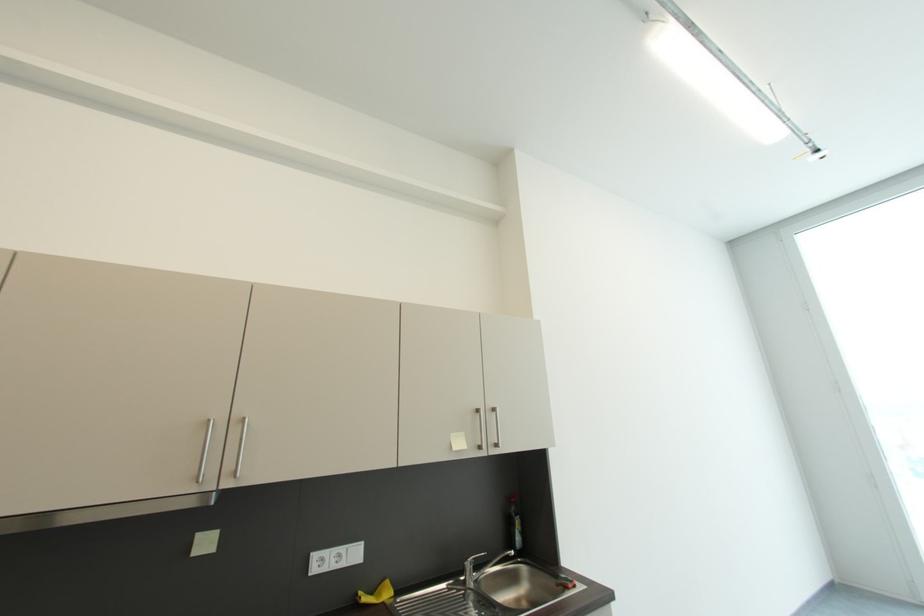
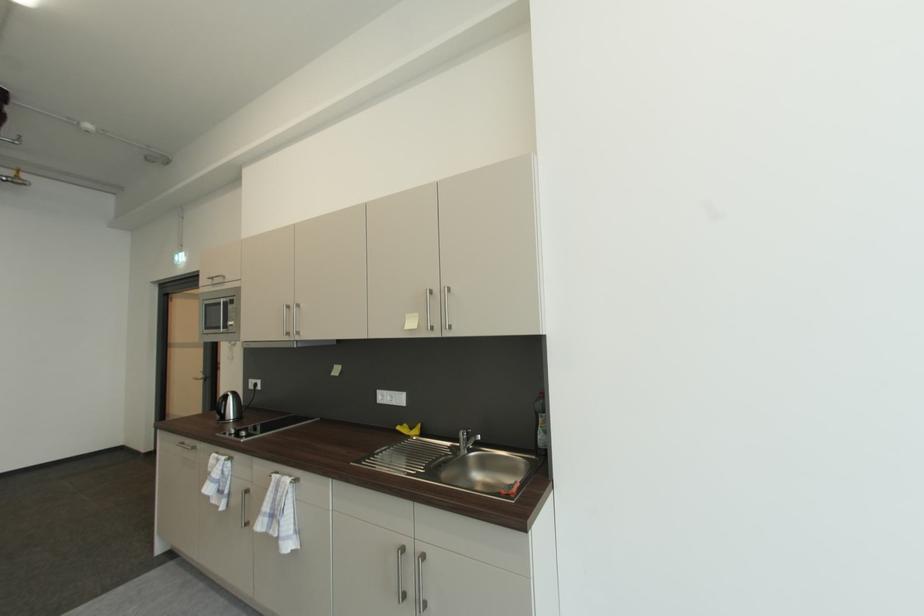
The point at (x=470, y=567) is marked in the first image. Where is the corresponding point in the second image?

(465, 435)